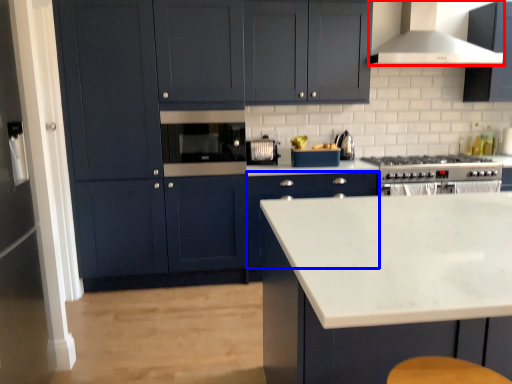
Question: Which of the following is the closest to the observer, home appliance (highlighted by a red box) or cabinetry (highlighted by a blue box)?

Choices:
 (A) home appliance
 (B) cabinetry

Answer: (A)